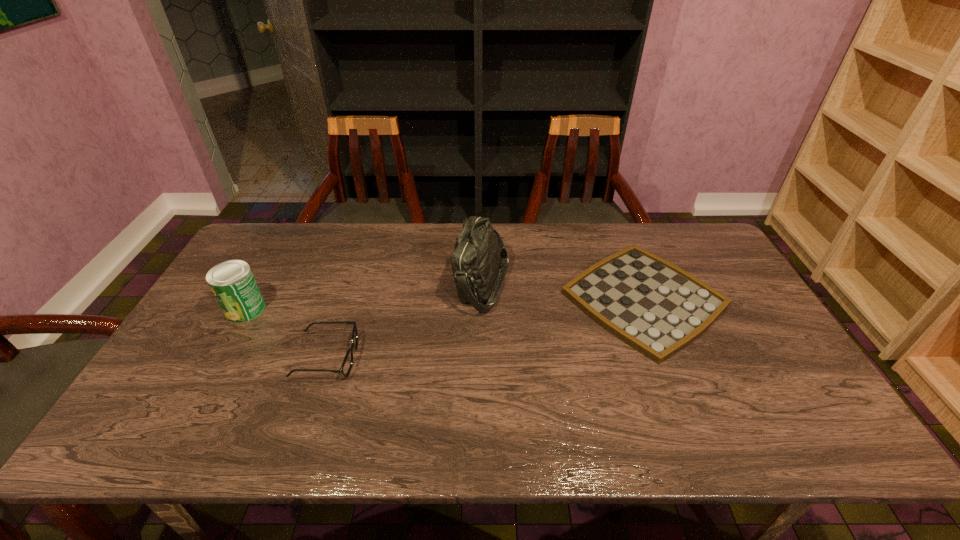
Identify the location of shoulder bag. (479, 252).

At what (x,y) coordinates should I click in order to perform the action: click on the tallest object. Please return your answer as a coordinate pair (x, y). The height and width of the screenshot is (540, 960). Looking at the image, I should click on (479, 252).

The height and width of the screenshot is (540, 960). In order to click on the leftmost object in this screenshot , I will do `click(232, 282)`.

The image size is (960, 540). I want to click on the second tallest object, so click(x=232, y=282).

This screenshot has height=540, width=960. I want to click on spectacles, so click(x=346, y=367).

The image size is (960, 540). In order to click on the third tallest object in this screenshot , I will do `click(346, 367)`.

Identify the location of the shortest object. (654, 306).

Locate an element on the screen. Image resolution: width=960 pixels, height=540 pixels. the rightmost object is located at coordinates (654, 306).

Where is `vacant space located at the front padded panel of the second object from right to left`? vacant space located at the front padded panel of the second object from right to left is located at coordinates (406, 284).

Identify the location of vacant space located 0.070m at the front padded panel of the second object from right to left. The height and width of the screenshot is (540, 960). [432, 284].